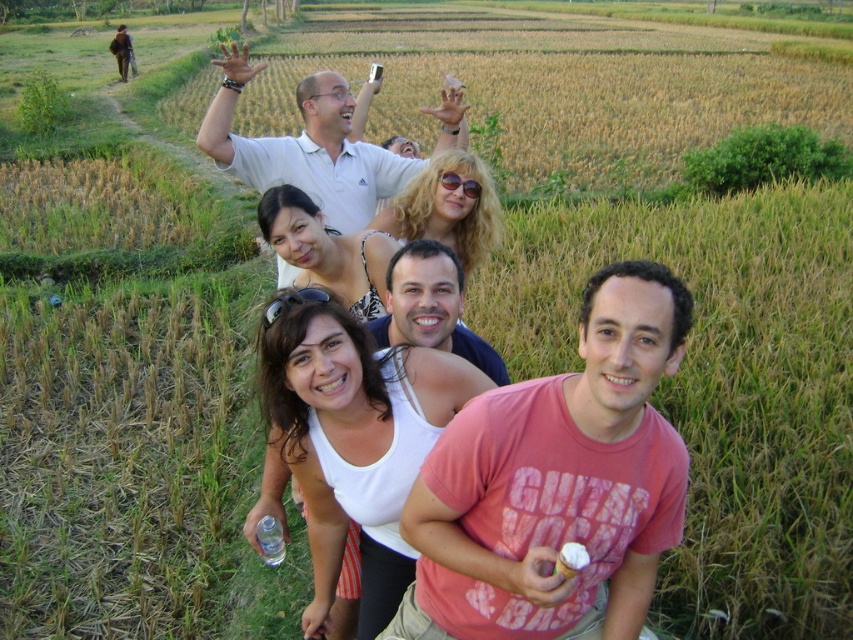
You are a photographer trying to adjust the composition of the photo to ensure all subjects are visible. Considering the white cotton shirt at center and the white matte shirt at upper center, which one is shorter and might need to be positioned differently to avoid being obscured?

The white cotton shirt at center is shorter than the white matte shirt at upper center, so it might need to be positioned differently to avoid being obscured.

You are standing at the center of the image and want to locate the white cotton shirt at center. Which direction should you look to find it?

The white cotton shirt at center is located at point coordinates of approximately 0.527 on the x axis and 0.499 on the y axis, which is very close to the center of the image. Therefore, you should look directly ahead or straight ahead to find it.